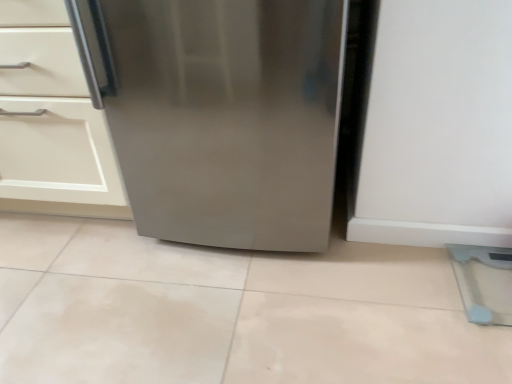
Question: Considering the relative sizes of stainless steel refrigerator at center and matte white cabinet at left in the image provided, is stainless steel refrigerator at center thinner than matte white cabinet at left?

Choices:
 (A) yes
 (B) no

Answer: (B)

Question: Is stainless steel refrigerator at center further to the viewer compared to matte white cabinet at left?

Choices:
 (A) no
 (B) yes

Answer: (A)

Question: Is stainless steel refrigerator at center aimed at matte white cabinet at left?

Choices:
 (A) no
 (B) yes

Answer: (A)

Question: Is stainless steel refrigerator at center positioned far away from matte white cabinet at left?

Choices:
 (A) yes
 (B) no

Answer: (B)

Question: Is stainless steel refrigerator at center facing away from matte white cabinet at left?

Choices:
 (A) no
 (B) yes

Answer: (A)

Question: From a real-world perspective, is stainless steel refrigerator at center under matte white cabinet at left?

Choices:
 (A) yes
 (B) no

Answer: (B)

Question: Is matte white cabinet at left further to the viewer compared to stainless steel refrigerator at center?

Choices:
 (A) yes
 (B) no

Answer: (A)

Question: Does matte white cabinet at left have a greater width compared to stainless steel refrigerator at center?

Choices:
 (A) yes
 (B) no

Answer: (B)

Question: Is the depth of matte white cabinet at left less than that of stainless steel refrigerator at center?

Choices:
 (A) no
 (B) yes

Answer: (A)

Question: Is matte white cabinet at left bigger than stainless steel refrigerator at center?

Choices:
 (A) no
 (B) yes

Answer: (B)

Question: Is matte white cabinet at left thinner than stainless steel refrigerator at center?

Choices:
 (A) yes
 (B) no

Answer: (A)

Question: Can you confirm if matte white cabinet at left is smaller than stainless steel refrigerator at center?

Choices:
 (A) no
 (B) yes

Answer: (A)

Question: Is stainless steel refrigerator at center in front of or behind matte white cabinet at left in the image?

Choices:
 (A) front
 (B) behind

Answer: (A)